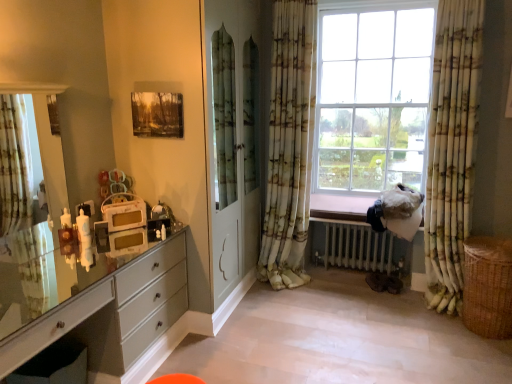
Question: Considering the relative positions of braided wicker basket at lower right and green and white textured curtain at right, placed as the 3th curtain when sorted from left to right, in the image provided, is braided wicker basket at lower right to the left of green and white textured curtain at right, placed as the 3th curtain when sorted from left to right, from the viewer's perspective?

Choices:
 (A) no
 (B) yes

Answer: (A)

Question: Does braided wicker basket at lower right have a greater height compared to green and white textured curtain at right, placed as the 3th curtain when sorted from left to right?

Choices:
 (A) no
 (B) yes

Answer: (A)

Question: Considering the relative sizes of braided wicker basket at lower right and green and white textured curtain at right, placed as the 3th curtain when sorted from left to right, in the image provided, is braided wicker basket at lower right smaller than green and white textured curtain at right, placed as the 3th curtain when sorted from left to right,?

Choices:
 (A) no
 (B) yes

Answer: (B)

Question: From the image's perspective, is braided wicker basket at lower right below green and white textured curtain at right, placed as the 3th curtain when sorted from left to right?

Choices:
 (A) no
 (B) yes

Answer: (B)

Question: Is braided wicker basket at lower right shorter than green and white textured curtain at right, placed as the 3th curtain when sorted from left to right?

Choices:
 (A) yes
 (B) no

Answer: (A)

Question: Considering the positions of matte white clock at left and matte wooden picture frame at upper center in the image, is matte white clock at left taller or shorter than matte wooden picture frame at upper center?

Choices:
 (A) short
 (B) tall

Answer: (A)

Question: Considering the relative positions of matte white clock at left and matte wooden picture frame at upper center in the image provided, is matte white clock at left to the left or to the right of matte wooden picture frame at upper center?

Choices:
 (A) right
 (B) left

Answer: (B)

Question: Is matte white clock at left inside the boundaries of matte wooden picture frame at upper center, or outside?

Choices:
 (A) inside
 (B) outside

Answer: (B)

Question: Considering the positions of point (134, 233) and point (155, 109), is point (134, 233) closer or farther from the camera than point (155, 109)?

Choices:
 (A) farther
 (B) closer

Answer: (A)

Question: From a real-world perspective, is white metallic radiator at lower right positioned above or below green and white floral curtain at center, which is the 2th curtain in left-to-right order?

Choices:
 (A) above
 (B) below

Answer: (B)

Question: Is white metallic radiator at lower right wider or thinner than green and white floral curtain at center, positioned as the second curtain in right-to-left order?

Choices:
 (A) wide
 (B) thin

Answer: (A)

Question: Considering the positions of white metallic radiator at lower right and green and white floral curtain at center, positioned as the second curtain in right-to-left order, in the image, is white metallic radiator at lower right bigger or smaller than green and white floral curtain at center, positioned as the second curtain in right-to-left order,?

Choices:
 (A) small
 (B) big

Answer: (A)

Question: From the image's perspective, relative to green and white floral curtain at center, which is the 2th curtain in left-to-right order, is white metallic radiator at lower right above or below?

Choices:
 (A) above
 (B) below

Answer: (B)

Question: Based on their positions, is braided wicker basket at lower right located to the left or right of green and white textured curtain at right, which is counted as the first curtain, starting from the right?

Choices:
 (A) left
 (B) right

Answer: (B)

Question: From a real-world perspective, is braided wicker basket at lower right above or below green and white textured curtain at right, which is counted as the first curtain, starting from the right?

Choices:
 (A) above
 (B) below

Answer: (B)